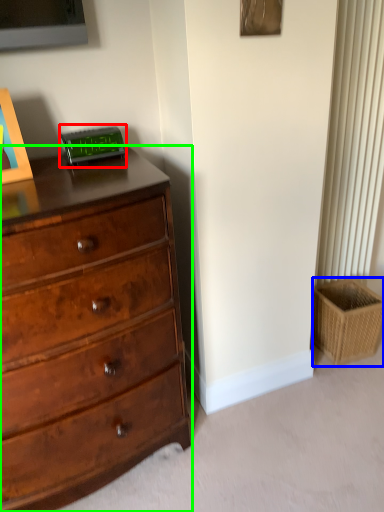
Question: Which is nearer to the alarm clock (highlighted by a red box)? basket (highlighted by a blue box) or chest of drawers (highlighted by a green box).

Choices:
 (A) basket
 (B) chest of drawers

Answer: (B)